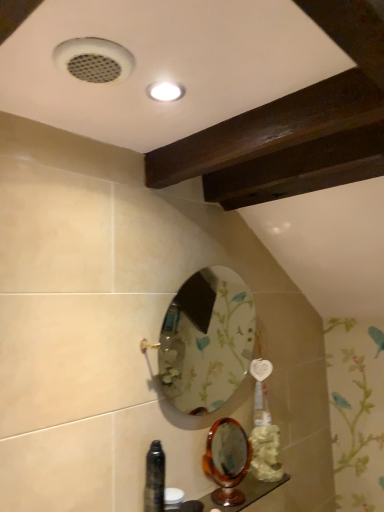
Question: Considering the relative positions of floral-patterned glass mirror at center, the 1th mirror positioned from the top, and wooden polished counter top at lower center in the image provided, is floral-patterned glass mirror at center, the 1th mirror positioned from the top, to the right of wooden polished counter top at lower center from the viewer's perspective?

Choices:
 (A) no
 (B) yes

Answer: (A)

Question: Does floral-patterned glass mirror at center, the 1th mirror positioned from the top, have a greater height compared to wooden polished counter top at lower center?

Choices:
 (A) no
 (B) yes

Answer: (B)

Question: Could you tell me if floral-patterned glass mirror at center, the 1th mirror positioned from the top, is turned towards wooden polished counter top at lower center?

Choices:
 (A) no
 (B) yes

Answer: (A)

Question: From the image's perspective, does floral-patterned glass mirror at center, the 1th mirror positioned from the top, appear lower than wooden polished counter top at lower center?

Choices:
 (A) yes
 (B) no

Answer: (B)

Question: Is point (175, 509) closer or farther from the camera than point (231, 483)?

Choices:
 (A) farther
 (B) closer

Answer: (B)

Question: Is wooden polished counter top at lower center inside or outside of wooden polished mirror at lower center, placed as the first mirror when sorted from bottom to top?

Choices:
 (A) inside
 (B) outside

Answer: (B)

Question: Is wooden polished counter top at lower center bigger or smaller than wooden polished mirror at lower center, placed as the first mirror when sorted from bottom to top?

Choices:
 (A) big
 (B) small

Answer: (B)

Question: From a real-world perspective, is wooden polished counter top at lower center positioned above or below wooden polished mirror at lower center, acting as the 2th mirror starting from the top?

Choices:
 (A) above
 (B) below

Answer: (B)

Question: Is wooden polished counter top at lower center spatially inside floral-patterned glass mirror at center, the 1th mirror positioned from the top, or outside of it?

Choices:
 (A) outside
 (B) inside

Answer: (A)

Question: Considering their positions, is wooden polished counter top at lower center located in front of or behind floral-patterned glass mirror at center, the 1th mirror positioned from the top?

Choices:
 (A) front
 (B) behind

Answer: (B)

Question: Is point (210, 500) closer or farther from the camera than point (185, 369)?

Choices:
 (A) closer
 (B) farther

Answer: (A)

Question: From their relative heights in the image, would you say wooden polished counter top at lower center is taller or shorter than floral-patterned glass mirror at center, which is counted as the 2th mirror, starting from the bottom?

Choices:
 (A) short
 (B) tall

Answer: (A)

Question: From a real-world perspective, is wooden polished mirror at lower center, acting as the 2th mirror starting from the top, positioned above or below floral-patterned glass mirror at center, which is counted as the 2th mirror, starting from the bottom?

Choices:
 (A) above
 (B) below

Answer: (B)

Question: Considering the relative positions of wooden polished mirror at lower center, placed as the first mirror when sorted from bottom to top, and floral-patterned glass mirror at center, which is counted as the 2th mirror, starting from the bottom, in the image provided, is wooden polished mirror at lower center, placed as the first mirror when sorted from bottom to top, to the left or to the right of floral-patterned glass mirror at center, which is counted as the 2th mirror, starting from the bottom,?

Choices:
 (A) left
 (B) right

Answer: (B)